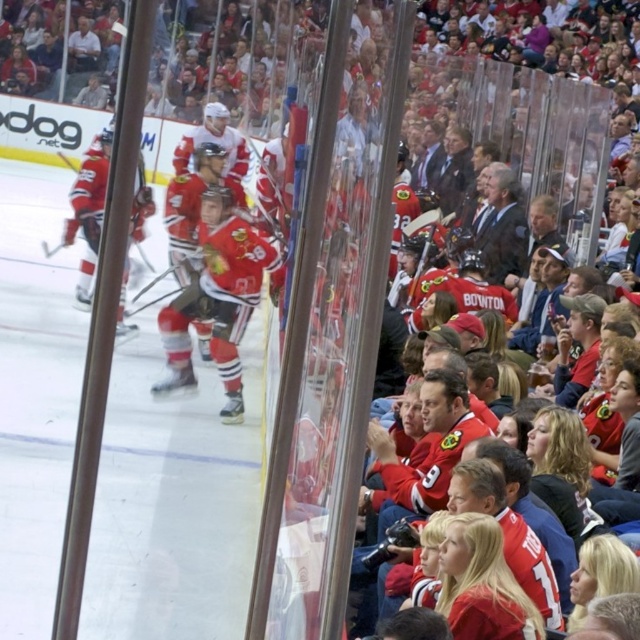
Is matte jersey at center above red jersey at left?

No.

Does matte jersey at center have a greater height compared to red jersey at left?

Correct, matte jersey at center is much taller as red jersey at left.

Describe the element at coordinates (218, 298) in the screenshot. This screenshot has height=640, width=640. I see `matte jersey at center` at that location.

Identify the location of matte jersey at center. (218, 298).

Which is more to the right, matte jersey at center or red jersey hockey at center?

matte jersey at center is more to the right.

Can you confirm if matte jersey at center is positioned to the right of red jersey hockey at center?

Correct, you'll find matte jersey at center to the right of red jersey hockey at center.

Describe the element at coordinates (218, 298) in the screenshot. The image size is (640, 640). I see `matte jersey at center` at that location.

Locate an element on the screen. This screenshot has width=640, height=640. matte jersey at center is located at coordinates (218, 298).

Is point (224, 141) behind point (129, 312)?

Yes, it is behind point (129, 312).

Can you confirm if red jersey hockey player at center is thinner than red jersey hockey at center?

Incorrect, red jersey hockey player at center's width is not less than red jersey hockey at center's.

Where is `red jersey hockey player at center`? The height and width of the screenshot is (640, 640). red jersey hockey player at center is located at coordinates (212, 257).